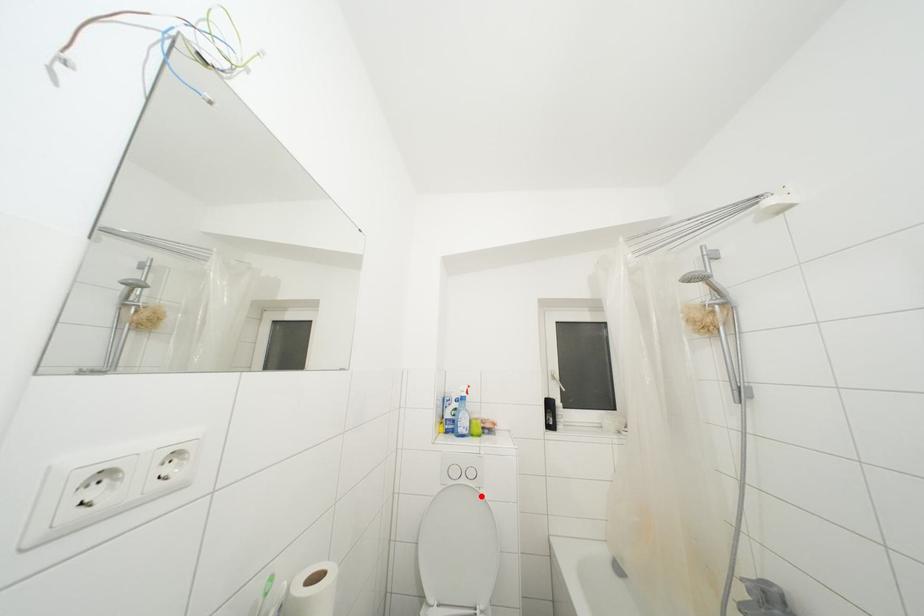
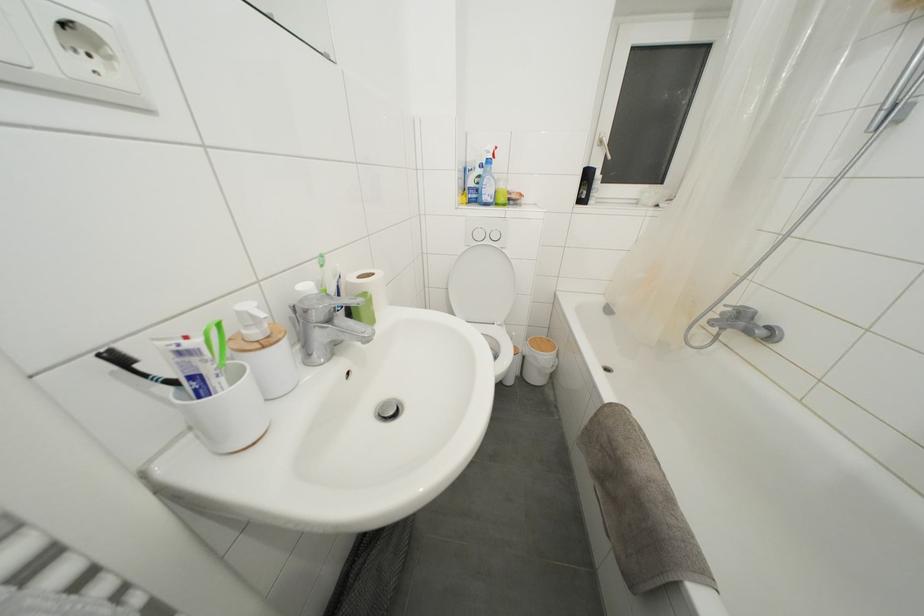
Locate, in the second image, the point that corresponds to the highlighted location in the first image.

(505, 256)